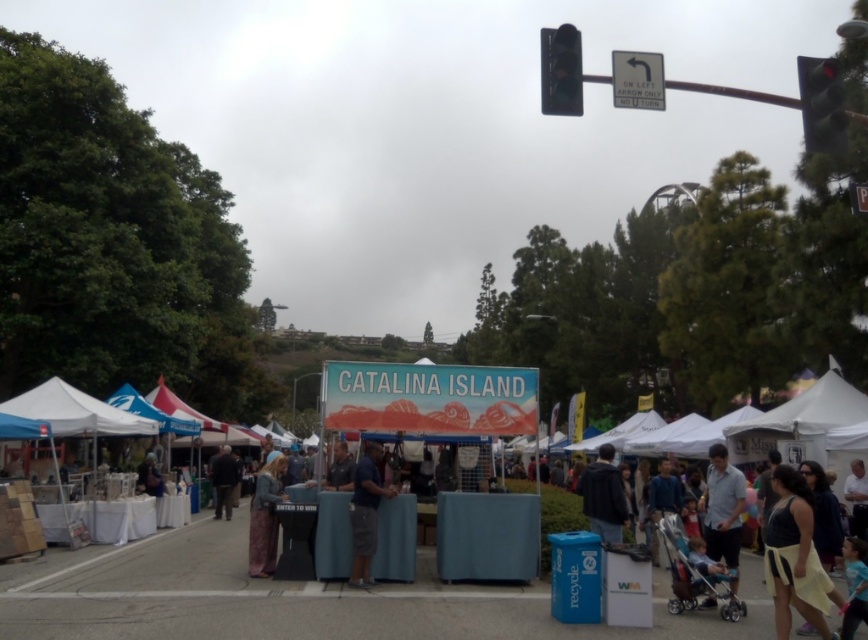
You are at the fair and want to find the blue fabric booth at center. According to the map, it is located at point 0.936, 0.348. If you are standing at the origin point, which direction should you move to reach it?

The blue fabric booth at center is located at point (301, 598), so you should move northeast to reach it since the x and y coordinates are both positive.

You are a visitor at the event and want to know which object is taller between the blue fabric booth at center and the black plastic traffic light at upper right. Can you determine this based on their positions?

The blue fabric booth at center is shorter than the black plastic traffic light at upper right, so the traffic light is taller.

You are at the Catalina Island booth and need to locate the dark gray jacket at center. Which direction should you look relative to the black plastic traffic light at upper right?

You should look to the right of the black plastic traffic light at upper right to find the dark gray jacket at center, as the traffic light is to the left of the jacket.